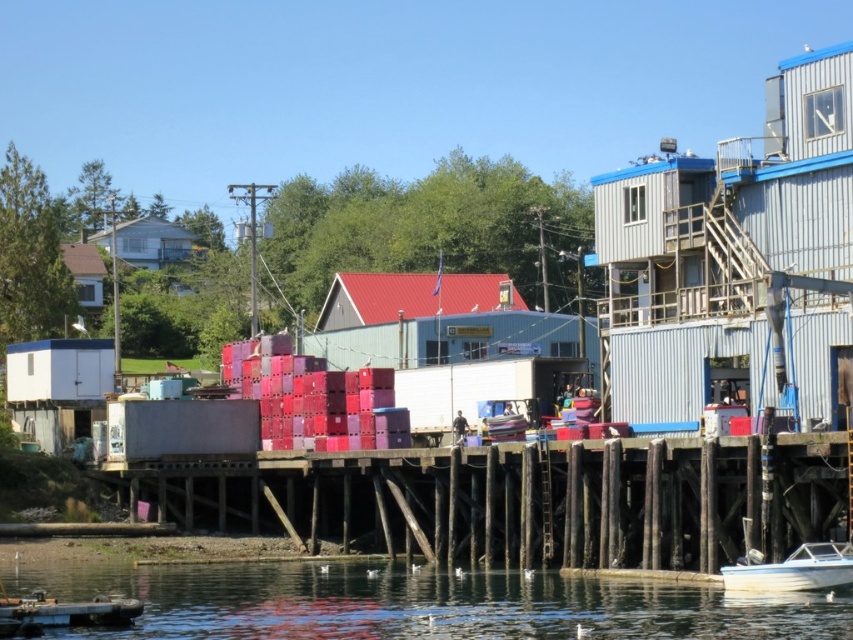
You are standing at the edge of the waterfront scene and want to reach the wooden dock at lower center. Which direction should you move to in relation to the large industrial building with a blue roof and gray exterior located to the right?

Since the wooden dock at lower center is located at point (524, 499), you should move towards the left relative to the large industrial building with a blue roof and gray exterior to reach it.

You are a crane operator tasked with lifting the white glossy boat at lower right from the transparent water at lower center. Considering their heights, which object should be raised first to avoid collision?

The transparent water at lower center has a greater height than the white glossy boat at lower right. To avoid collision, you should raise the white glossy boat at lower right first to ensure it clears the lower height before lifting the water, but since water cannot be lifted, the boat must be raised to pass under the water level. However, this scenario is physically impossible as water cannot be lifted. Please clarify the operation requirements.

You are standing at the point marked as point (422, 604) in the image. What is the first object you would encounter if you move straight ahead?

The transparent water at lower center is located at point (422, 604), so moving straight ahead from there would immediately place you in the transparent water at lower center.